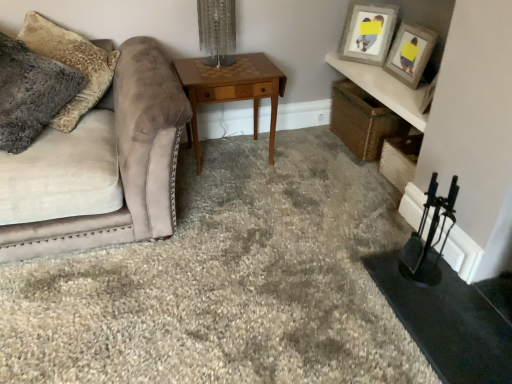
I want to click on free location above matte gray picture frame at upper right, arranged as the second picture frame when viewed from the right (from a real-world perspective), so click(376, 1).